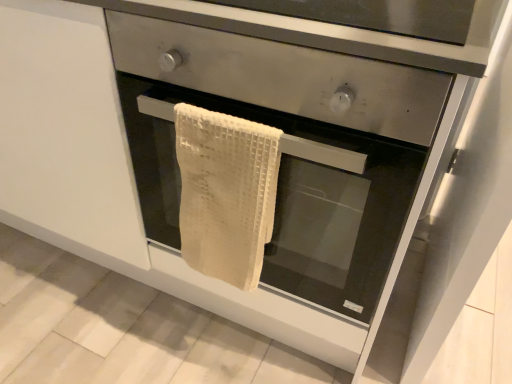
In order to face beige woven towel at center, should I rotate leftwards or rightwards?

You should rotate left by 4.387 degrees.

The width and height of the screenshot is (512, 384). Describe the element at coordinates (291, 198) in the screenshot. I see `white woven towel at center` at that location.

The height and width of the screenshot is (384, 512). I want to click on beige woven towel at center, so (x=226, y=192).

Where is `bath towel located below the white waffle towel at center (from the image's perspective)`? Image resolution: width=512 pixels, height=384 pixels. bath towel located below the white waffle towel at center (from the image's perspective) is located at coordinates (226, 192).

Considering the sizes of objects beige woven towel at center and white waffle towel at center in the image provided, who is taller, beige woven towel at center or white waffle towel at center?

beige woven towel at center.

Is beige woven towel at center far away from white waffle towel at center?

No, there isn't a large distance between beige woven towel at center and white waffle towel at center.

How different are the orientations of beige woven towel at center and white waffle towel at center in degrees?

The angular difference between beige woven towel at center and white waffle towel at center is 1.46 degrees.

How many degrees apart are the facing directions of white waffle towel at center and beige woven towel at center?

The facing directions of white waffle towel at center and beige woven towel at center are 1.46 degrees apart.

Can you confirm if white waffle towel at center is positioned to the left of beige woven towel at center?

In fact, white waffle towel at center is to the right of beige woven towel at center.

Is white waffle towel at center situated inside beige woven towel at center or outside?

white waffle towel at center exists outside the volume of beige woven towel at center.

Is point (270, 48) farther from camera compared to point (199, 120)?

No, (270, 48) is in front of (199, 120).

From the image's perspective, which is above, white woven towel at center or white waffle towel at center?

white waffle towel at center.

Based on their sizes in the image, would you say white woven towel at center is bigger or smaller than white waffle towel at center?

Considering their sizes, white woven towel at center takes up more space than white waffle towel at center.

Measure the distance between white woven towel at center and white waffle towel at center.

white woven towel at center and white waffle towel at center are 7.92 inches apart from each other.

Is white woven towel at center to the left of white waffle towel at center from the viewer's perspective?

Indeed, white woven towel at center is positioned on the left side of white waffle towel at center.

Which is more to the right, white waffle towel at center or white woven towel at center?

Positioned to the right is white waffle towel at center.

Which object is closer to the camera taking this photo, white waffle towel at center or white woven towel at center?

Positioned in front is white waffle towel at center.

Based on the photo, from a real-world perspective, relative to white woven towel at center, is white waffle towel at center vertically above or below?

Clearly, from a real-world perspective, white waffle towel at center is above white woven towel at center.

Is white waffle towel at center positioned beyond the bounds of white woven towel at center?

white waffle towel at center is positioned outside white woven towel at center.

Between white woven towel at center and beige woven towel at center, which one has larger size?

white woven towel at center.

Which object is closer to the camera taking this photo, white woven towel at center or beige woven towel at center?

Positioned in front is white woven towel at center.

Would you say white woven towel at center is inside or outside beige woven towel at center?

white woven towel at center lies outside beige woven towel at center.

How different are the orientations of white woven towel at center and beige woven towel at center in degrees?

The facing directions of white woven towel at center and beige woven towel at center are 0.692 degrees apart.

From their relative heights in the image, would you say beige woven towel at center is taller or shorter than white woven towel at center?

Considering their sizes, beige woven towel at center has less height than white woven towel at center.

Based on the photo, can you confirm if beige woven towel at center is thinner than white woven towel at center?

Indeed, beige woven towel at center has a lesser width compared to white woven towel at center.

From the image's perspective, is beige woven towel at center positioned above or below white woven towel at center?

From the image's perspective, beige woven towel at center appears below white woven towel at center.

In the scene shown: Considering their positions, is beige woven towel at center located in front of or behind white woven towel at center?

In the image, beige woven towel at center appears behind white woven towel at center.

At what (x,y) coordinates should I click in order to perform the action: click on bath towel on the left side of white waffle towel at center. Please return your answer as a coordinate pair (x, y). This screenshot has width=512, height=384. Looking at the image, I should click on (226, 192).

What are the coordinates of `drawer in front of the beige woven towel at center` in the screenshot? It's located at (283, 76).

Looking at the image, which one is located further to beige woven towel at center, white woven towel at center or white waffle towel at center?

white waffle towel at center is positioned further to the anchor beige woven towel at center.

Considering their positions, is white waffle towel at center positioned further to white woven towel at center than beige woven towel at center?

white waffle towel at center is positioned further to the anchor white woven towel at center.

Consider the image. Estimate the real-world distances between objects in this image. Which object is closer to white waffle towel at center, white woven towel at center or beige woven towel at center?

beige woven towel at center is closer to white waffle towel at center.

Estimate the real-world distances between objects in this image. Which object is closer to beige woven towel at center, white waffle towel at center or white woven towel at center?

white woven towel at center is positioned closer to the anchor beige woven towel at center.

Estimate the real-world distances between objects in this image. Which object is further from white woven towel at center, beige woven towel at center or white waffle towel at center?

Among the two, white waffle towel at center is located further to white woven towel at center.

When comparing their distances from white waffle towel at center, does beige woven towel at center or white woven towel at center seem closer?

Among the two, beige woven towel at center is located nearer to white waffle towel at center.

Locate an element on the screen. oven between white waffle towel at center and beige woven towel at center in the up-down direction is located at coordinates (291, 198).